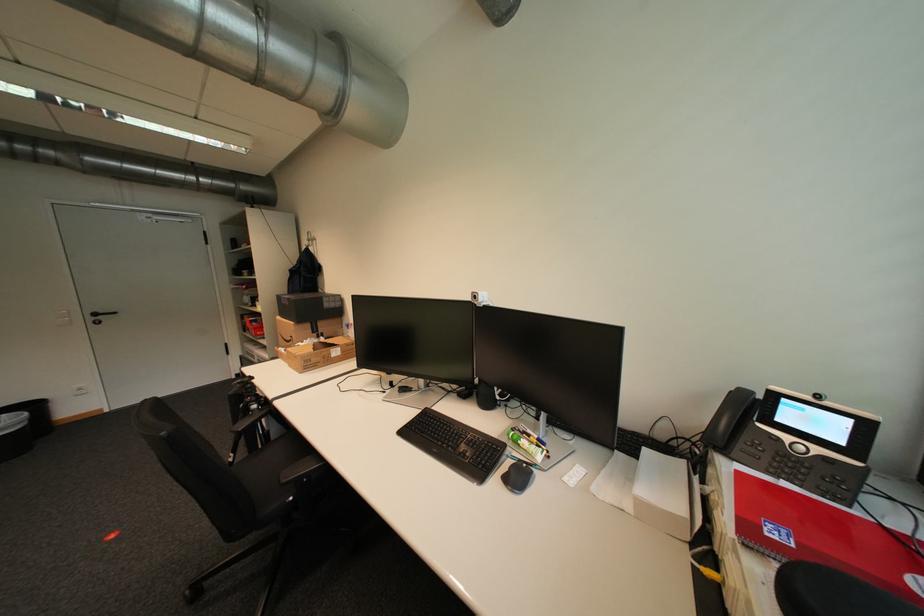
What do you see at coordinates (278, 459) in the screenshot?
I see `the chair sitting surface` at bounding box center [278, 459].